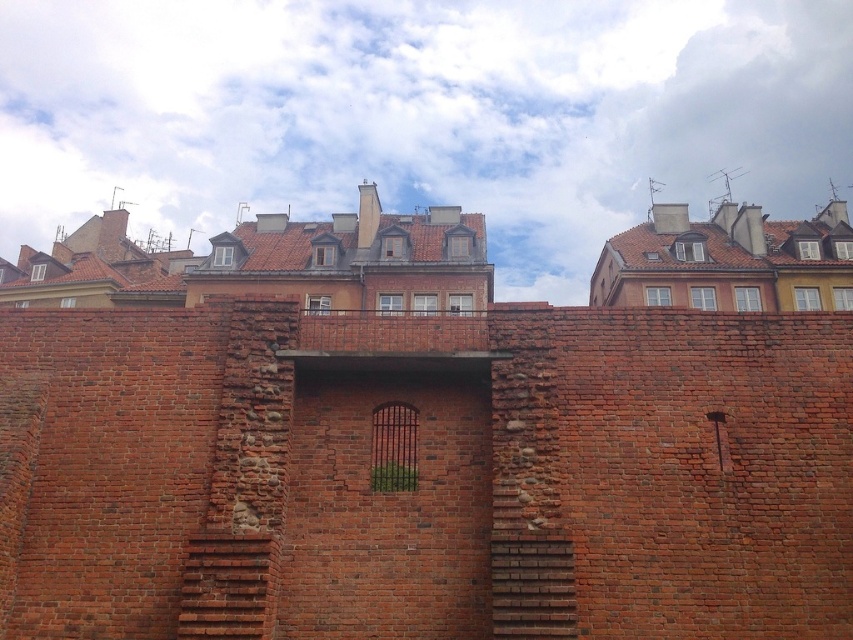
Does brick stairs at center appear on the left side of smooth brick stairs at center?

Correct, you'll find brick stairs at center to the left of smooth brick stairs at center.

Who is more distant from viewer, (177, 625) or (531, 564)?

Point (177, 625)

The height and width of the screenshot is (640, 853). Find the location of `brick stairs at center`. brick stairs at center is located at coordinates (229, 586).